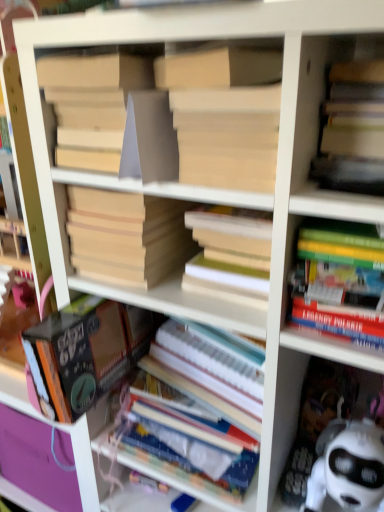
Question: From a real-world perspective, is white paper at center, marked as the sixth book in a top-to-bottom arrangement, located higher than beige cardboard book at center, the third book viewed from the top?

Choices:
 (A) no
 (B) yes

Answer: (A)

Question: Can you confirm if white paper at center, the 1th book when ordered from bottom to top, is wider than beige cardboard book at center, the third book viewed from the top?

Choices:
 (A) yes
 (B) no

Answer: (A)

Question: From the image's perspective, is white paper at center, marked as the sixth book in a top-to-bottom arrangement, located beneath beige cardboard book at center, marked as the 4th book in a bottom-to-top arrangement?

Choices:
 (A) yes
 (B) no

Answer: (A)

Question: Is white paper at center, the 1th book when ordered from bottom to top, located outside beige cardboard book at center, the third book viewed from the top?

Choices:
 (A) yes
 (B) no

Answer: (A)

Question: Are white paper at center, the 1th book when ordered from bottom to top, and beige cardboard book at center, the third book viewed from the top, located far from each other?

Choices:
 (A) yes
 (B) no

Answer: (B)

Question: From a real-world perspective, is white paper at center, marked as the sixth book in a top-to-bottom arrangement, positioned under beige cardboard book at center, the third book viewed from the top, based on gravity?

Choices:
 (A) yes
 (B) no

Answer: (A)

Question: From the image's perspective, is matte cardboard book at center, which is the 6th book in bottom-to-top order, above matte yellow book at upper right, marked as the 2th book in a top-to-bottom arrangement?

Choices:
 (A) yes
 (B) no

Answer: (A)

Question: Is matte cardboard book at center, placed as the 1th book when sorted from top to bottom, facing away from matte yellow book at upper right, the 5th book positioned from the bottom?

Choices:
 (A) no
 (B) yes

Answer: (A)

Question: Is matte cardboard book at center, placed as the 1th book when sorted from top to bottom, taller than matte yellow book at upper right, the 5th book positioned from the bottom?

Choices:
 (A) yes
 (B) no

Answer: (A)

Question: Can you confirm if matte cardboard book at center, which is the 6th book in bottom-to-top order, is smaller than matte yellow book at upper right, marked as the 2th book in a top-to-bottom arrangement?

Choices:
 (A) no
 (B) yes

Answer: (B)

Question: Is matte cardboard book at center, placed as the 1th book when sorted from top to bottom, closer to camera compared to matte yellow book at upper right, the 5th book positioned from the bottom?

Choices:
 (A) no
 (B) yes

Answer: (A)

Question: Is matte yellow book at upper right, the 5th book positioned from the bottom, completely or partially inside matte cardboard book at center, which is the 6th book in bottom-to-top order?

Choices:
 (A) no
 (B) yes

Answer: (A)

Question: Can you confirm if white paper at center, the 1th book when ordered from bottom to top, is positioned to the right of matte yellow book at upper right, the 5th book positioned from the bottom?

Choices:
 (A) no
 (B) yes

Answer: (A)